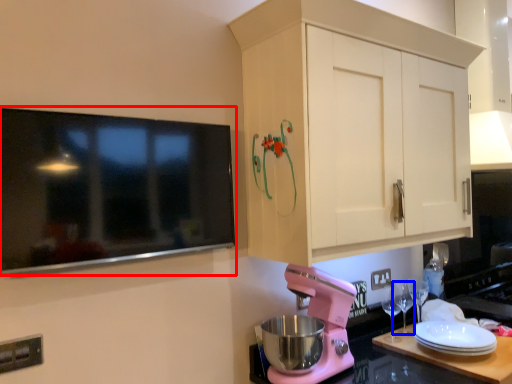
Question: Which of the following is the closest to the observer, television (highlighted by a red box) or wine glass (highlighted by a blue box)?

Choices:
 (A) television
 (B) wine glass

Answer: (A)